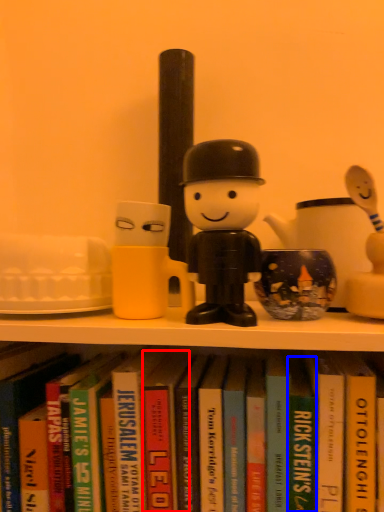
Question: Which object is closer to the camera taking this photo, paperback book (highlighted by a red box) or paperback book (highlighted by a blue box)?

Choices:
 (A) paperback book
 (B) paperback book

Answer: (B)